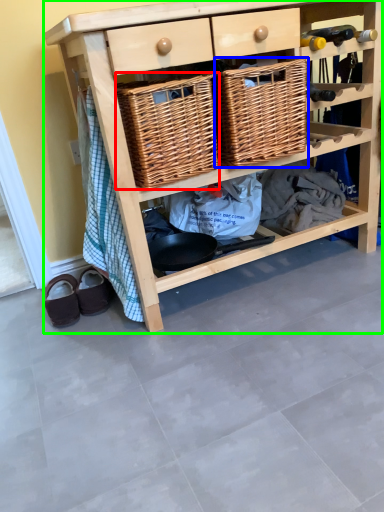
Question: Estimate the real-world distances between objects in this image. Which object is closer to basket (highlighted by a red box), basket (highlighted by a blue box) or shelf (highlighted by a green box)?

Choices:
 (A) basket
 (B) shelf

Answer: (A)